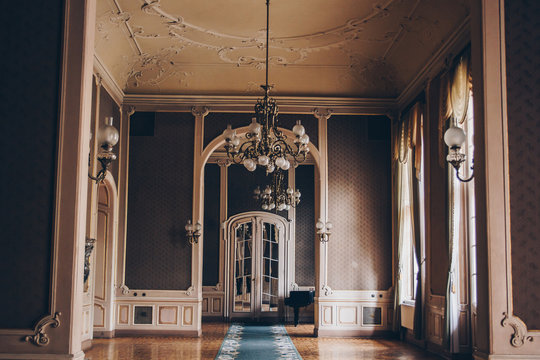
Find the location of a particular element. brown ceiling is located at coordinates (302, 23).